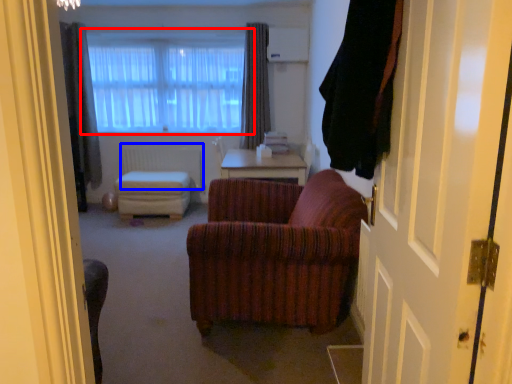
Question: Among these objects, which one is nearest to the camera, window (highlighted by a red box) or radiator (highlighted by a blue box)?

Choices:
 (A) window
 (B) radiator

Answer: (A)